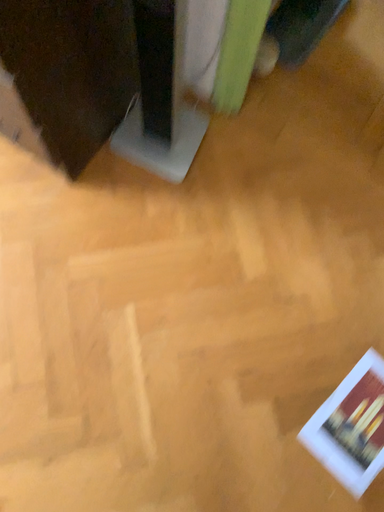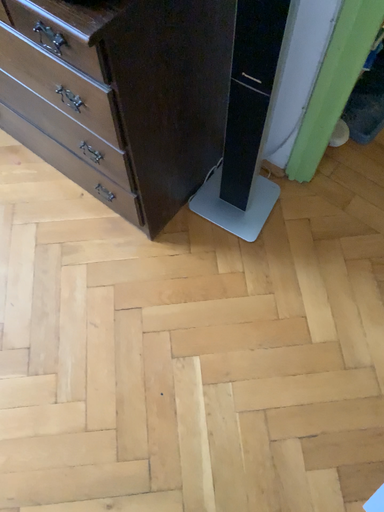
Question: Which way did the camera rotate in the video?

Choices:
 (A) rotated upward
 (B) rotated downward

Answer: (A)